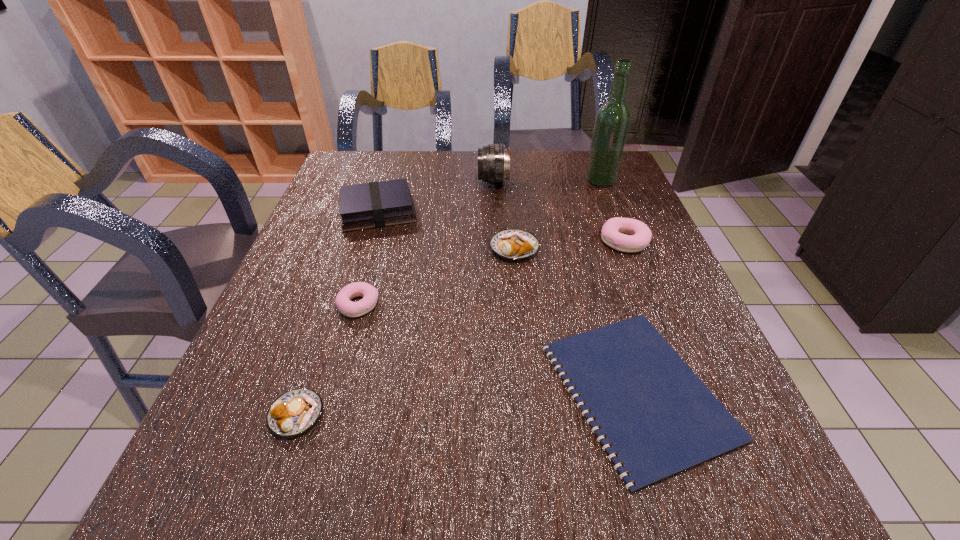
At what (x,y) coordinates should I click in order to perform the action: click on green liquor. Please return your answer as a coordinate pair (x, y). This screenshot has height=540, width=960. Looking at the image, I should click on (612, 121).

This screenshot has height=540, width=960. I want to click on the tallest object, so click(612, 121).

The image size is (960, 540). I want to click on the seventh shortest object, so click(x=493, y=160).

Where is `book`? This screenshot has width=960, height=540. book is located at coordinates (369, 205).

Image resolution: width=960 pixels, height=540 pixels. I want to click on the sixth shortest object, so click(369, 205).

Where is `the bigger pink pastry`? Image resolution: width=960 pixels, height=540 pixels. the bigger pink pastry is located at coordinates (639, 237).

Find the location of a particular element. Image resolution: width=960 pixels, height=540 pixels. the farther pink pastry is located at coordinates (639, 237).

Locate an element on the screen. The height and width of the screenshot is (540, 960). the farther brown pastry is located at coordinates (515, 244).

This screenshot has width=960, height=540. I want to click on the bigger brown pastry, so click(x=515, y=244).

Image resolution: width=960 pixels, height=540 pixels. In order to click on the left pink pastry in this screenshot , I will do `click(369, 293)`.